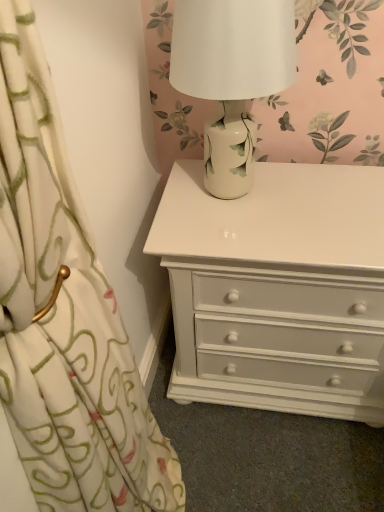
You are a GUI agent. You are given a task and a screenshot of the screen. Output one action in this format:
    pyautogui.click(x=<x>, y=<y>)
    Task: Click on the free spot above white glossy chest of drawers at center (from a real-world perspective)
    The width and height of the screenshot is (384, 512).
    Given the screenshot: What is the action you would take?
    pyautogui.click(x=286, y=203)